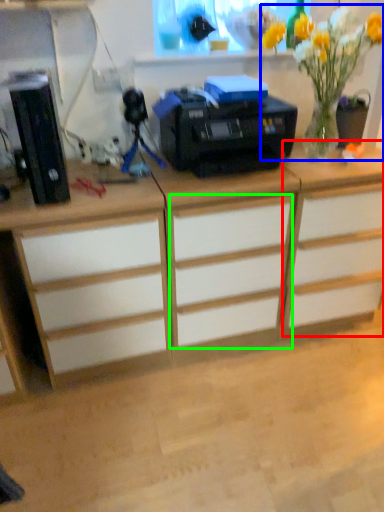
Question: Which is nearer to the cabinetry (highlighted by a red box)? floral arrangement (highlighted by a blue box) or drawer (highlighted by a green box).

Choices:
 (A) floral arrangement
 (B) drawer

Answer: (B)